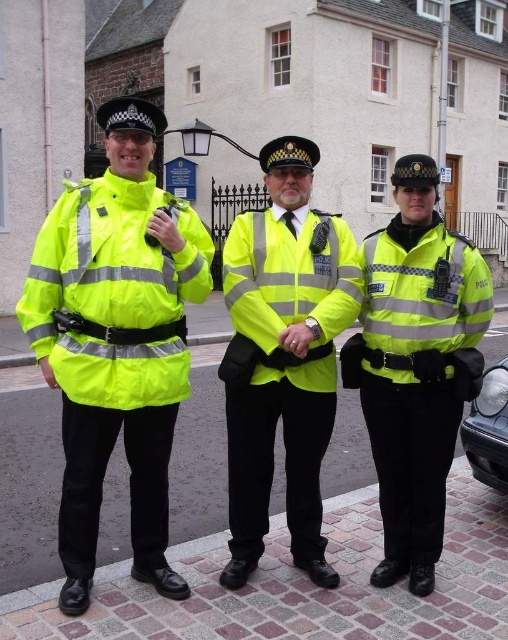
You are a pedestrian trying to locate the neon yellow reflective jacket at center in the image. Based on the coordinates provided, where exactly should you look?

You should look at point 0.575 on the horizontal axis and 0.555 on the vertical axis to find the neon yellow reflective jacket at center.

You are a pedestrian standing at the position of the viewer in the image. There is a neon yellow reflective jacket at left. Can you reach the jacket within 10 feet without moving?

The neon yellow reflective jacket at left is 11.73 feet away from the viewer, so you cannot reach it within 10 feet without moving.

Based on the photo, you are standing at point (117, 192) and want to take a photo of the three police officers in the scene. The camera you have can focus on subjects up to 4 meters away. Will you be able to capture the officers clearly in your photo?

The point (117, 192) and camera are 3.75 meters apart from each other. Since the camera can focus up to 4 meters, you can capture the officers clearly as the distance is within the range.